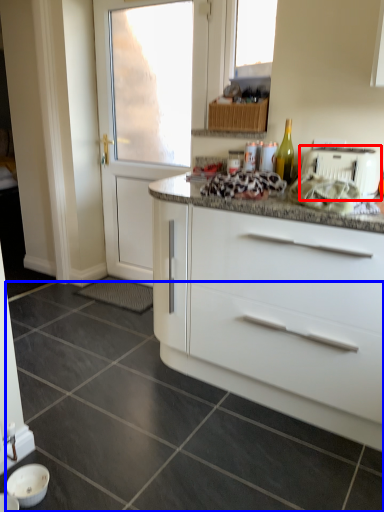
Question: Among these objects, which one is nearest to the camera, toaster (highlighted by a red box) or granite (highlighted by a blue box)?

Choices:
 (A) toaster
 (B) granite

Answer: (B)